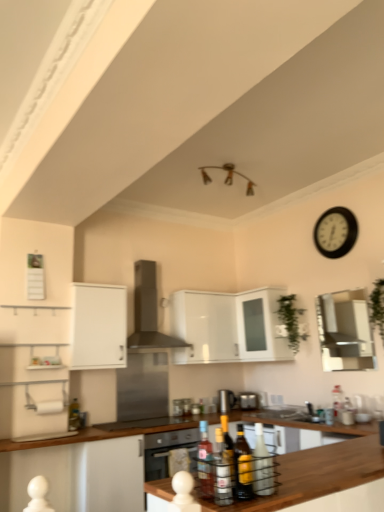
I want to click on unoccupied region to the right of translucent glass bottles at center, which is the first bottle in front-to-back order, so click(x=288, y=490).